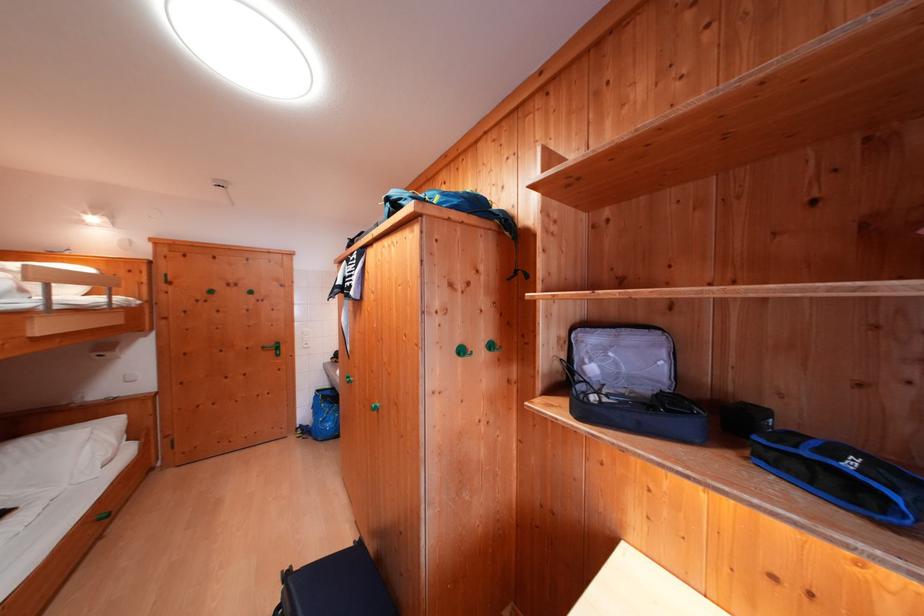
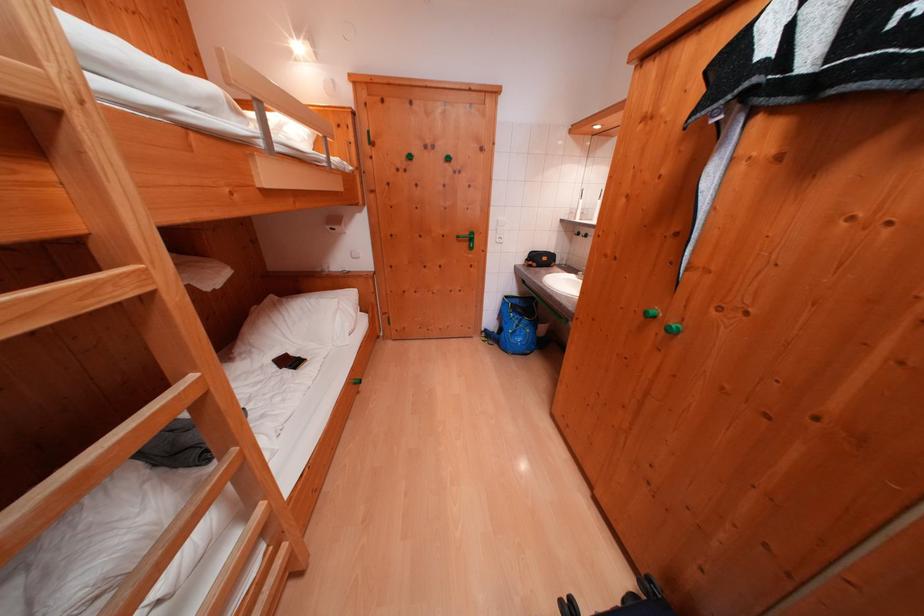
Locate, in the second image, the point that corresponds to the point at 271,352 in the first image.

(466, 241)